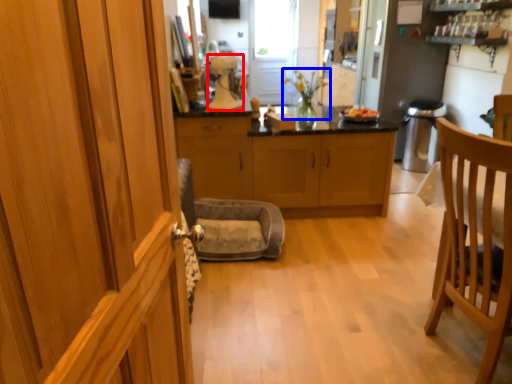
Question: Which object appears closest to the camera in this image, kitchen appliance (highlighted by a red box) or houseplant (highlighted by a blue box)?

Choices:
 (A) kitchen appliance
 (B) houseplant

Answer: (A)